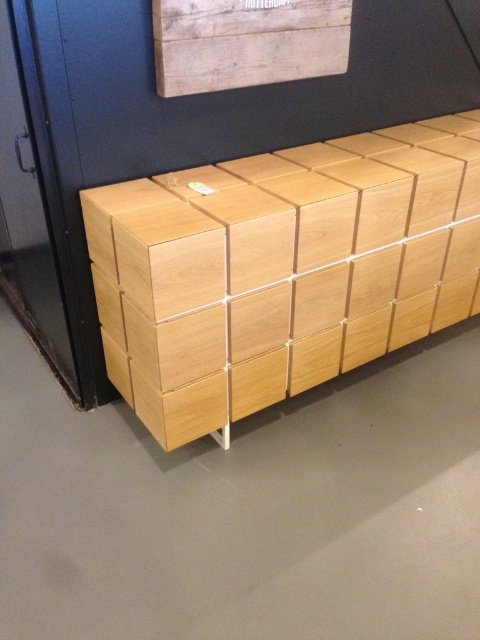
Locate an element on the screen. This screenshot has height=640, width=480. natural wood crate at center is located at coordinates (282, 269).

Who is shorter, natural wood crate at center or wooden crate at upper center?

wooden crate at upper center is shorter.

Which is in front, point (218, 188) or point (259, 38)?

Point (259, 38)

At what (x,y) coordinates should I click in order to perform the action: click on natural wood crate at center. Please return your answer as a coordinate pair (x, y). This screenshot has height=640, width=480. Looking at the image, I should click on (282, 269).